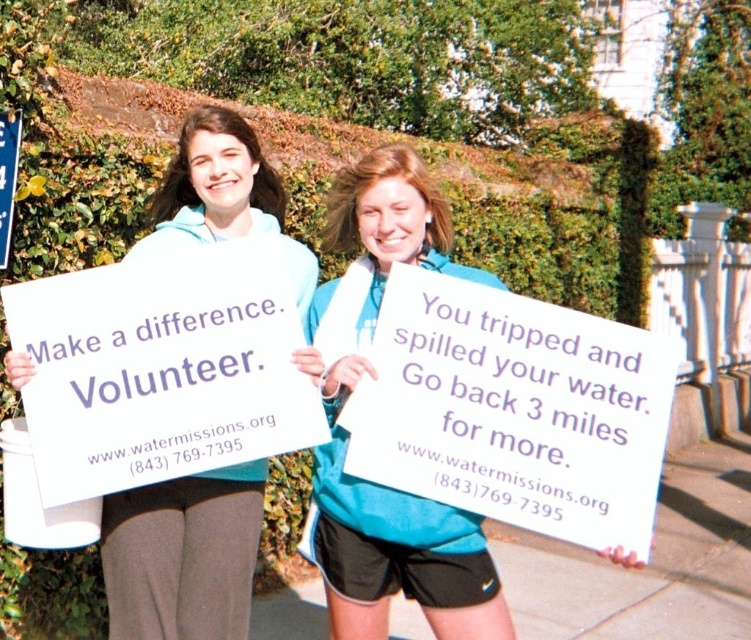
Looking at this image, you are a photographer trying to capture both the white paper sign at center and the matte blue sweatshirt at center in a single shot. Considering their sizes, which object should you focus on to ensure both are clearly visible in the frame?

The white paper sign at center is larger than the matte blue sweatshirt at center. To ensure both are clearly visible, focus on the white paper sign at center as it occupies more space in the frame, allowing the smaller matte blue sweatshirt at center to be captured alongside it.

What is the significance of the point at coordinates (182, 556) in the image?

The point at coordinates (182, 556) corresponds to the matte blue sweatshirt at center.

You are a photographer trying to capture both signs clearly in a single photo. The white paper sign at center and the blue plastic sign at upper left are both important. However, you notice that one of them is partially blocking the other. Which sign is blocking the other one?

The white paper sign at center is in front of the blue plastic sign at upper left, so it is blocking the blue plastic sign at upper left.